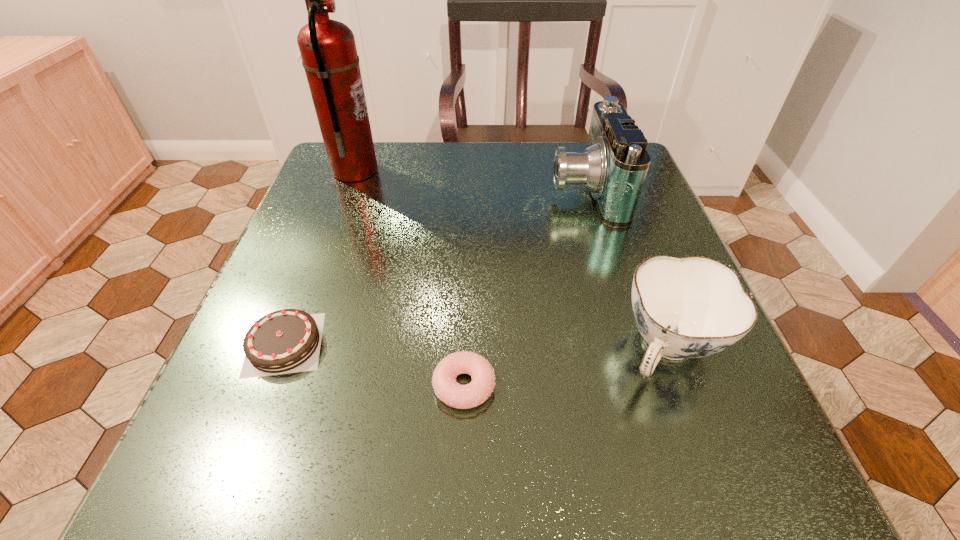
The image size is (960, 540). I want to click on free location that satisfies the following two spatial constraints: 1. on the front-facing side of the third tallest object; 2. on the left side of the camcorder, so [x=632, y=348].

Where is `free space in the image that satisfies the following two spatial constraints: 1. on the nozzle side of the fire extinguisher; 2. on the back side of the third object from left to right`? The image size is (960, 540). free space in the image that satisfies the following two spatial constraints: 1. on the nozzle side of the fire extinguisher; 2. on the back side of the third object from left to right is located at coordinates (275, 386).

Image resolution: width=960 pixels, height=540 pixels. I want to click on vacant area that satisfies the following two spatial constraints: 1. on the front side of the chinaware; 2. on the left side of the chocolate cake, so click(283, 348).